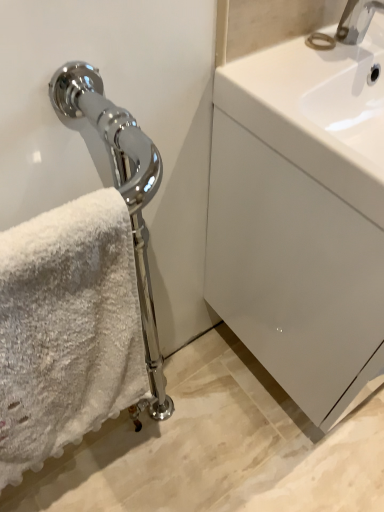
In order to face white glossy sink at upper right, should I rotate leftwards or rightwards?

To align with it, rotate right about 25.441°.

The image size is (384, 512). What do you see at coordinates (317, 112) in the screenshot?
I see `white glossy sink at upper right` at bounding box center [317, 112].

The width and height of the screenshot is (384, 512). I want to click on white fluffy towel at left, so click(66, 329).

In order to click on white glossy sink at upper right in this screenshot , I will do `click(317, 112)`.

From the image's perspective, would you say white glossy sink at upper right is positioned over white fluffy towel at left?

Yes, from the image's perspective, white glossy sink at upper right is on top of white fluffy towel at left.

Considering the sizes of objects white glossy sink at upper right and white fluffy towel at left in the image provided, who is shorter, white glossy sink at upper right or white fluffy towel at left?

Standing shorter between the two is white glossy sink at upper right.

Which is more to the right, white glossy sink at upper right or white fluffy towel at left?

From the viewer's perspective, white glossy sink at upper right appears more on the right side.

Looking at their sizes, would you say white glossy sink at upper right is wider or thinner than white fluffy towel at left?

white glossy sink at upper right is wider than white fluffy towel at left.

From a real-world perspective, is white glossy sink at upper right over chrome metallic faucet at upper right?

No, from a real-world perspective, white glossy sink at upper right is not above chrome metallic faucet at upper right.

Which object is thinner, white glossy sink at upper right or chrome metallic faucet at upper right?

Thinner between the two is chrome metallic faucet at upper right.

Image resolution: width=384 pixels, height=512 pixels. I want to click on tap located on the left of white glossy sink at upper right, so click(357, 20).

In the image, is white glossy sink at upper right positioned in front of or behind chrome metallic faucet at upper right?

Clearly, white glossy sink at upper right is in front of chrome metallic faucet at upper right.

Looking at the image, does white glossy drawer at right seem bigger or smaller compared to white glossy sink at upper right?

white glossy drawer at right is bigger than white glossy sink at upper right.

From the image's perspective, which one is positioned lower, white glossy drawer at right or white glossy sink at upper right?

From the image's view, white glossy drawer at right is below.

From a real-world perspective, which object stands above the other?

white glossy sink at upper right.

Considering the positions of objects white glossy drawer at right and white glossy sink at upper right in the image provided, who is behind, white glossy drawer at right or white glossy sink at upper right?

white glossy sink at upper right.

Which of these two, white fluffy towel at left or white glossy drawer at right, is bigger?

Bigger between the two is white glossy drawer at right.

Based on their positions, is white fluffy towel at left located to the left or right of white glossy drawer at right?

From the image, it's evident that white fluffy towel at left is to the left of white glossy drawer at right.

Which of these two, white fluffy towel at left or white glossy drawer at right, stands shorter?

white fluffy towel at left.

Image resolution: width=384 pixels, height=512 pixels. I want to click on tap located above the white fluffy towel at left (from a real-world perspective), so click(357, 20).

Consider the image. What's the angular difference between chrome metallic faucet at upper right and white fluffy towel at left's facing directions?

0.464 degrees.

Which is more to the right, chrome metallic faucet at upper right or white fluffy towel at left?

From the viewer's perspective, chrome metallic faucet at upper right appears more on the right side.

From the image's perspective, is chrome metallic faucet at upper right below white fluffy towel at left?

No, from the image's perspective, chrome metallic faucet at upper right is not beneath white fluffy towel at left.

Measure the distance between chrome metallic faucet at upper right and white glossy sink at upper right.

chrome metallic faucet at upper right is 17.17 centimeters away from white glossy sink at upper right.

Is chrome metallic faucet at upper right in front of or behind white glossy sink at upper right in the image?

Clearly, chrome metallic faucet at upper right is behind white glossy sink at upper right.

Is chrome metallic faucet at upper right with white glossy sink at upper right?

No.

Considering the sizes of objects chrome metallic faucet at upper right and white glossy sink at upper right in the image provided, who is smaller, chrome metallic faucet at upper right or white glossy sink at upper right?

chrome metallic faucet at upper right is smaller.

From the picture: Between white glossy drawer at right and white fluffy towel at left, which one appears on the left side from the viewer's perspective?

white fluffy towel at left.

Is white glossy drawer at right oriented towards white fluffy towel at left?

No.

From a real-world perspective, is white glossy drawer at right physically below white fluffy towel at left?

Yes, from a real-world perspective, white glossy drawer at right is under white fluffy towel at left.

At what (x,y) coordinates should I click in order to perform the action: click on towel below the white glossy sink at upper right (from the image's perspective). Please return your answer as a coordinate pair (x, y). The width and height of the screenshot is (384, 512). Looking at the image, I should click on (66, 329).

This screenshot has height=512, width=384. There is a white glossy sink at upper right. What are the coordinates of `tap above it (from a real-world perspective)` in the screenshot? It's located at (357, 20).

Based on their spatial positions, is white glossy drawer at right or chrome metallic faucet at upper right closer to white glossy sink at upper right?

chrome metallic faucet at upper right is positioned closer to the anchor white glossy sink at upper right.

Which object lies further to the anchor point white fluffy towel at left, white glossy drawer at right or chrome metallic faucet at upper right?

chrome metallic faucet at upper right.

Which object lies further to the anchor point white glossy drawer at right, white glossy sink at upper right or chrome metallic faucet at upper right?

chrome metallic faucet at upper right.

When comparing their distances from white glossy sink at upper right, does chrome metallic faucet at upper right or white fluffy towel at left seem closer?

chrome metallic faucet at upper right is closer to white glossy sink at upper right.

Which object lies nearer to the anchor point white glossy drawer at right, white fluffy towel at left or chrome metallic faucet at upper right?

Based on the image, white fluffy towel at left appears to be nearer to white glossy drawer at right.

Based on their spatial positions, is chrome metallic faucet at upper right or white glossy drawer at right further from white fluffy towel at left?

chrome metallic faucet at upper right lies further to white fluffy towel at left than the other object.

Based on their spatial positions, is white glossy drawer at right or white glossy sink at upper right further from white fluffy towel at left?

white glossy sink at upper right is further to white fluffy towel at left.

Looking at this image, based on their spatial positions, is white fluffy towel at left or chrome metallic faucet at upper right further from white glossy sink at upper right?

Based on the image, white fluffy towel at left appears to be further to white glossy sink at upper right.

Where is `tap situated between white fluffy towel at left and white glossy drawer at right from left to right`? The width and height of the screenshot is (384, 512). tap situated between white fluffy towel at left and white glossy drawer at right from left to right is located at coordinates (357, 20).

This screenshot has height=512, width=384. Find the location of `counter top located between white fluffy towel at left and white glossy drawer at right in the left-right direction`. counter top located between white fluffy towel at left and white glossy drawer at right in the left-right direction is located at coordinates (317, 112).

Locate an element on the screen. This screenshot has width=384, height=512. counter top between chrome metallic faucet at upper right and white glossy drawer at right from top to bottom is located at coordinates (317, 112).

Identify the location of tap located between white fluffy towel at left and white glossy sink at upper right in the left-right direction. This screenshot has width=384, height=512. (357, 20).